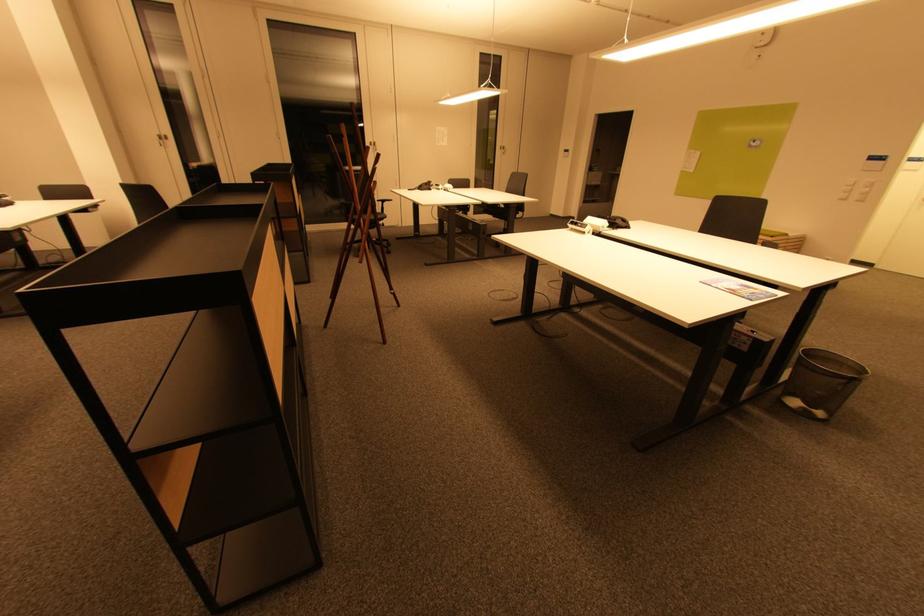
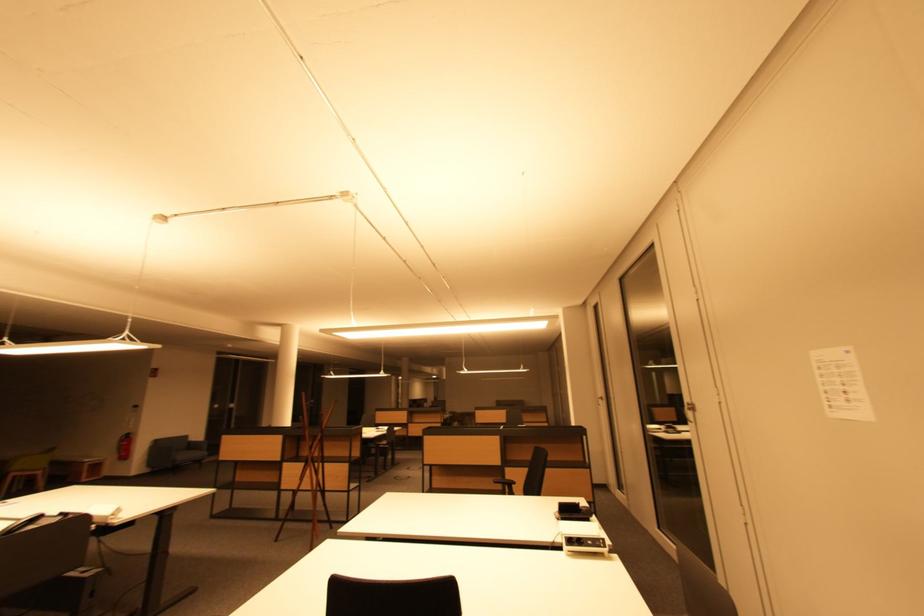
Locate, in the second image, the point that corresponds to point (166, 140) in the first image.

(605, 400)